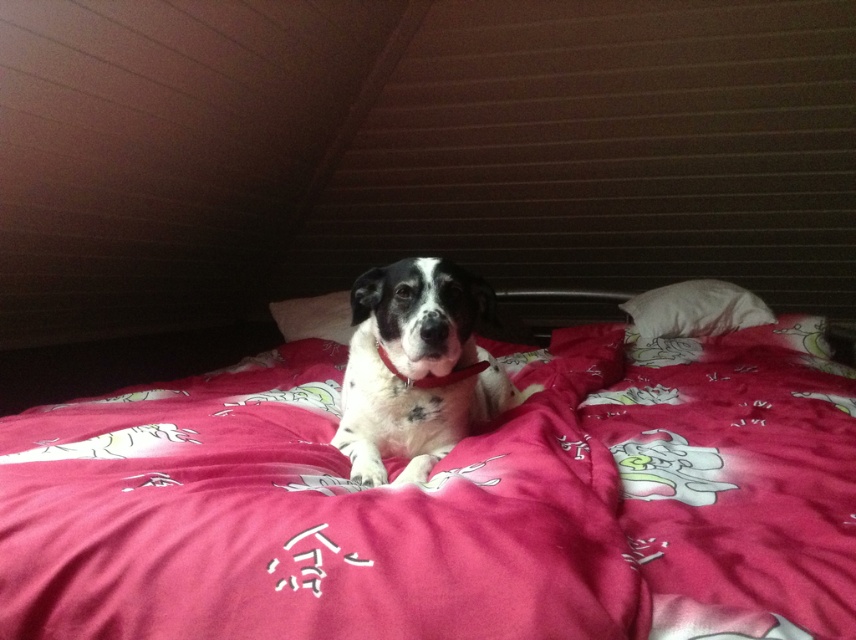
You are standing in the room and want to place a small decoration on the bed. There are two points on the bed where you can place it. The first point is at coordinate point (759, 323) and the second point is at coordinate point (330, 324). Which point is closer to you?

Point (759, 323) is closer to the camera than point (330, 324). So the point closer to you is point (759, 323).